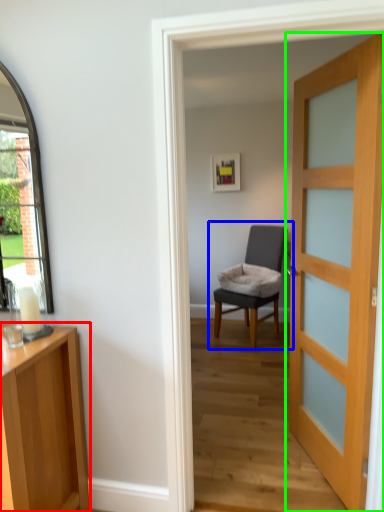
Question: Which object is the closest to the cabinetry (highlighted by a red box)? Choose among these: chair (highlighted by a blue box) or door (highlighted by a green box).

Choices:
 (A) chair
 (B) door

Answer: (B)